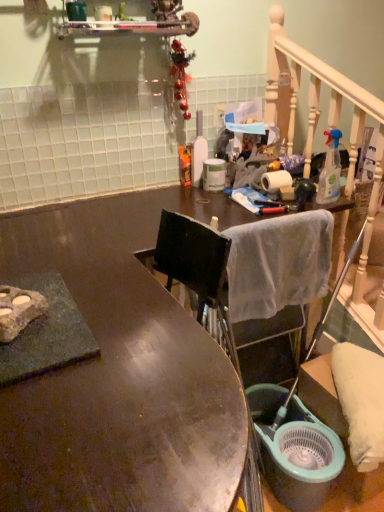
Locate an element on the screen. This screenshot has height=512, width=384. shiny brown desk at center is located at coordinates (121, 371).

Locate an element on the screen. This screenshot has width=384, height=512. teal plastic bucket at lower right is located at coordinates (294, 449).

What is the approximate width of clear plastic spray bottle at upper right, acting as the 1th bottle starting from the right?

2.70 inches.

At what (x,y) coordinates should I click in order to perform the action: click on white glossy bottle at center, marked as the 1th bottle in a back-to-front arrangement. Please return your answer as a coordinate pair (x, y). The width and height of the screenshot is (384, 512). Looking at the image, I should click on pyautogui.click(x=198, y=151).

From a real-world perspective, between teal plastic bucket at lower right and white soft towel at center, who is vertically lower?

teal plastic bucket at lower right, from a real-world perspective.

Between teal plastic bucket at lower right and white soft towel at center, which one has larger size?

teal plastic bucket at lower right.

Is teal plastic bucket at lower right aimed at white soft towel at center?

No, teal plastic bucket at lower right is not facing towards white soft towel at center.

Based on the photo, between teal plastic bucket at lower right and white soft towel at center, which one has larger width?

teal plastic bucket at lower right.

From a real-world perspective, relative to shiny brown desk at center, is white soft towel at center vertically above or below?

From a real-world perspective, white soft towel at center is physically above shiny brown desk at center.

Considering the sizes of objects white soft towel at center and shiny brown desk at center in the image provided, who is taller, white soft towel at center or shiny brown desk at center?

shiny brown desk at center is taller.

Does white soft towel at center contain shiny brown desk at center?

No, shiny brown desk at center is not inside white soft towel at center.

Between white soft towel at center and shiny brown desk at center, which one has smaller size?

white soft towel at center is smaller.

Which point is more forward, (199, 139) or (284, 185)?

Point (284, 185)

How far apart are white glossy bottle at center, marked as the 1th bottle in a back-to-front arrangement, and white matte toilet paper at upper right?

white glossy bottle at center, marked as the 1th bottle in a back-to-front arrangement, and white matte toilet paper at upper right are 12.52 inches apart from each other.

Is white glossy bottle at center, marked as the 1th bottle in a back-to-front arrangement, shorter than white matte toilet paper at upper right?

No, white glossy bottle at center, marked as the 1th bottle in a back-to-front arrangement, is not shorter than white matte toilet paper at upper right.

Is white glossy bottle at center, acting as the first bottle starting from the left, inside the boundaries of white matte toilet paper at upper right, or outside?

The correct answer is: outside.

Is point (111, 198) behind point (195, 180)?

No, it is in front of (195, 180).

In the scene shown: Is shiny brown desk at center far away from white glossy bottle at center, marked as the second bottle in a right-to-left arrangement?

shiny brown desk at center is near white glossy bottle at center, marked as the second bottle in a right-to-left arrangement, not far away.

Considering the sizes of objects shiny brown desk at center and white glossy bottle at center, acting as the first bottle starting from the left, in the image provided, who is bigger, shiny brown desk at center or white glossy bottle at center, acting as the first bottle starting from the left,?

With larger size is shiny brown desk at center.

From a real-world perspective, between shiny brown desk at center and white glossy bottle at center, marked as the second bottle in a right-to-left arrangement, who is vertically higher?

From a 3D spatial view, white glossy bottle at center, marked as the second bottle in a right-to-left arrangement, is above.

Considering the relative sizes of teal plastic bucket at lower right and clear plastic spray bottle at upper right, acting as the 1th bottle starting from the right, in the image provided, is teal plastic bucket at lower right bigger than clear plastic spray bottle at upper right, acting as the 1th bottle starting from the right,?

Yes.

Image resolution: width=384 pixels, height=512 pixels. Identify the location of bottle that appears on the right of teal plastic bucket at lower right. (330, 170).

Does teal plastic bucket at lower right contain clear plastic spray bottle at upper right, marked as the 2th bottle in a left-to-right arrangement?

No.

Is teal plastic bucket at lower right facing towards clear plastic spray bottle at upper right, acting as the 1th bottle starting from the right?

No, teal plastic bucket at lower right is not facing towards clear plastic spray bottle at upper right, acting as the 1th bottle starting from the right.

Is shiny brown desk at center situated inside white matte toilet paper at upper right or outside?

shiny brown desk at center is spatially situated outside white matte toilet paper at upper right.

Considering the relative sizes of shiny brown desk at center and white matte toilet paper at upper right in the image provided, is shiny brown desk at center thinner than white matte toilet paper at upper right?

Incorrect, the width of shiny brown desk at center is not less than that of white matte toilet paper at upper right.

From the image's perspective, is shiny brown desk at center above white matte toilet paper at upper right?

No.

Which object is thinner, white matte toilet paper at upper right or clear plastic spray bottle at upper right, acting as the 1th bottle starting from the right?

clear plastic spray bottle at upper right, acting as the 1th bottle starting from the right, is thinner.

From the image's perspective, which is above, white matte toilet paper at upper right or clear plastic spray bottle at upper right, marked as the 2th bottle in a left-to-right arrangement?

clear plastic spray bottle at upper right, marked as the 2th bottle in a left-to-right arrangement, is shown above in the image.

Is white matte toilet paper at upper right inside or outside of clear plastic spray bottle at upper right, marked as the 2th bottle in a left-to-right arrangement?

white matte toilet paper at upper right is not inside clear plastic spray bottle at upper right, marked as the 2th bottle in a left-to-right arrangement, it's outside.

Does white matte toilet paper at upper right turn towards clear plastic spray bottle at upper right, acting as the 1th bottle starting from the right?

Yes, white matte toilet paper at upper right is aimed at clear plastic spray bottle at upper right, acting as the 1th bottle starting from the right.

Find the location of `bath towel in front of the teal plastic bucket at lower right`. bath towel in front of the teal plastic bucket at lower right is located at coordinates (278, 263).

This screenshot has height=512, width=384. In order to click on bath towel located behind the shiny brown desk at center in this screenshot , I will do `click(278, 263)`.

Estimate the real-world distances between objects in this image. Which object is closer to white soft towel at center, white glossy bottle at center, marked as the 1th bottle in a back-to-front arrangement, or clear plastic spray bottle at upper right, marked as the 2th bottle in a left-to-right arrangement?

clear plastic spray bottle at upper right, marked as the 2th bottle in a left-to-right arrangement, is positioned closer to the anchor white soft towel at center.

Looking at the image, which one is located closer to shiny brown desk at center, clear plastic spray bottle at upper right, acting as the 1th bottle starting from the right, or white matte toilet paper at upper right?

Among the two, white matte toilet paper at upper right is located nearer to shiny brown desk at center.

From the image, which object appears to be farther from white glossy bottle at center, acting as the first bottle starting from the left, clear plastic spray bottle at upper right, positioned as the 2th bottle in back-to-front order, or shiny brown desk at center?

Based on the image, shiny brown desk at center appears to be further to white glossy bottle at center, acting as the first bottle starting from the left.

Estimate the real-world distances between objects in this image. Which object is closer to white matte toilet paper at upper right, white soft towel at center or clear plastic spray bottle at upper right, acting as the 1th bottle starting from the right?

The object closer to white matte toilet paper at upper right is clear plastic spray bottle at upper right, acting as the 1th bottle starting from the right.

Based on their spatial positions, is teal plastic bucket at lower right or white matte toilet paper at upper right further from white soft towel at center?

teal plastic bucket at lower right is further to white soft towel at center.

Estimate the real-world distances between objects in this image. Which object is closer to white glossy bottle at center, marked as the second bottle in a right-to-left arrangement, white matte toilet paper at upper right or teal plastic bucket at lower right?

white matte toilet paper at upper right is positioned closer to the anchor white glossy bottle at center, marked as the second bottle in a right-to-left arrangement.

From the image, which object appears to be farther from clear plastic spray bottle at upper right, marked as the 2th bottle in a left-to-right arrangement, teal plastic bucket at lower right or shiny brown desk at center?

shiny brown desk at center is further to clear plastic spray bottle at upper right, marked as the 2th bottle in a left-to-right arrangement.

Based on the photo, when comparing their distances from shiny brown desk at center, does white soft towel at center or teal plastic bucket at lower right seem further?

Among the two, teal plastic bucket at lower right is located further to shiny brown desk at center.

At what (x,y) coordinates should I click in order to perform the action: click on bath towel between shiny brown desk at center and white matte toilet paper at upper right along the z-axis. Please return your answer as a coordinate pair (x, y). Looking at the image, I should click on point(278,263).

The width and height of the screenshot is (384, 512). Identify the location of toilet paper between white soft towel at center and white glossy bottle at center, marked as the second bottle in a right-to-left arrangement, from front to back. (275, 180).

You are a GUI agent. You are given a task and a screenshot of the screen. Output one action in this format:
    pyautogui.click(x=<x>, y=<y>)
    Task: Click on the bottle located between shiny brown desk at center and white matte toilet paper at upper right in the depth direction
    
    Given the screenshot: What is the action you would take?
    pyautogui.click(x=330, y=170)

Where is `bottle located between shiny brown desk at center and white glossy bottle at center, marked as the second bottle in a right-to-left arrangement, in the depth direction`? The height and width of the screenshot is (512, 384). bottle located between shiny brown desk at center and white glossy bottle at center, marked as the second bottle in a right-to-left arrangement, in the depth direction is located at coordinates (330, 170).